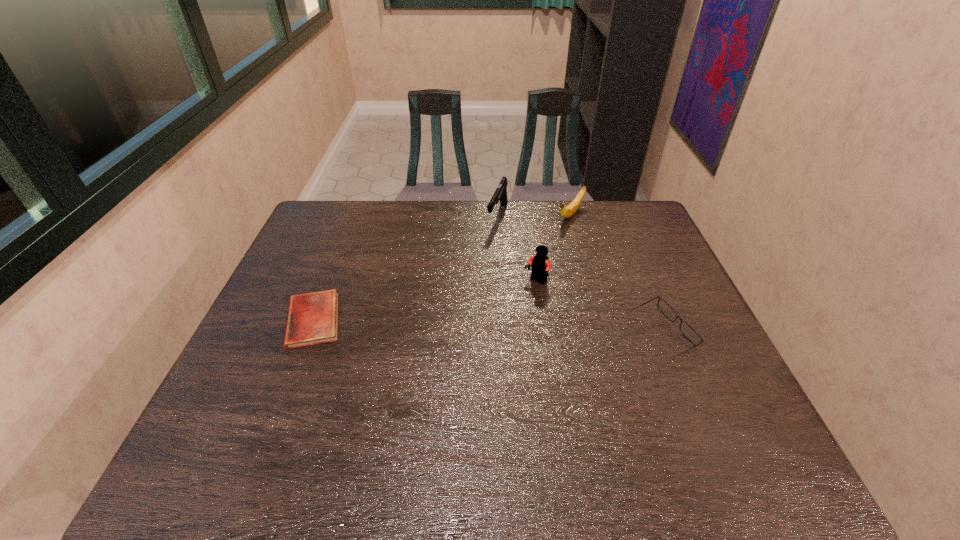
The width and height of the screenshot is (960, 540). I want to click on banana present at the far edge, so click(x=566, y=212).

Locate an element on the screen. object at the left edge is located at coordinates (312, 318).

Locate an element on the screen. object that is at the right edge is located at coordinates (664, 307).

At what (x,y) coordinates should I click in order to perform the action: click on free space at the far edge. Please return your answer as a coordinate pair (x, y). The width and height of the screenshot is (960, 540). Looking at the image, I should click on (517, 214).

Where is `vacant space at the left edge of the desktop`? vacant space at the left edge of the desktop is located at coordinates (303, 247).

Locate an element on the screen. free region at the right edge of the desktop is located at coordinates (654, 287).

This screenshot has height=540, width=960. I want to click on vacant point at the near left corner, so click(280, 420).

What are the coordinates of `vacant space at the far right corner` in the screenshot? It's located at (622, 218).

The height and width of the screenshot is (540, 960). In order to click on free spot between the third shortest object and the spectacles in this screenshot , I will do `click(616, 275)`.

Where is `free space that is in between the third object from right to left and the second shortest object`? This screenshot has height=540, width=960. free space that is in between the third object from right to left and the second shortest object is located at coordinates (599, 309).